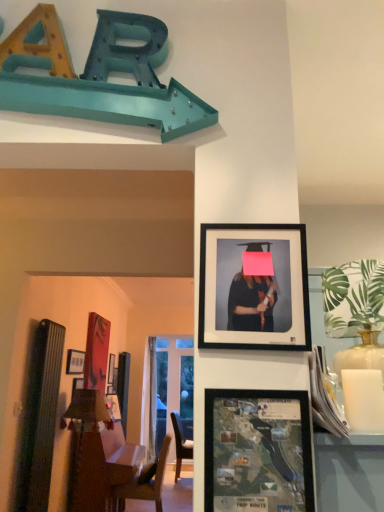
Question: Is wooden bulletin board at left positioned before matte black picture frame at upper left, acting as the third picture frame starting from the right?

Choices:
 (A) no
 (B) yes

Answer: (B)

Question: From a real-world perspective, is wooden bulletin board at left located higher than matte black picture frame at upper left, which appears as the first picture frame when viewed from the back?

Choices:
 (A) yes
 (B) no

Answer: (B)

Question: Does wooden bulletin board at left contain matte black picture frame at upper left, acting as the third picture frame starting from the right?

Choices:
 (A) no
 (B) yes

Answer: (A)

Question: Is wooden bulletin board at left not inside matte black picture frame at upper left, marked as the third picture frame in a top-to-bottom arrangement?

Choices:
 (A) no
 (B) yes

Answer: (B)

Question: Can you confirm if wooden bulletin board at left is smaller than matte black picture frame at upper left, marked as the 1th picture frame in a left-to-right arrangement?

Choices:
 (A) yes
 (B) no

Answer: (B)

Question: Is wooden bulletin board at left at the right side of matte black picture frame at upper left, the third picture frame viewed from the front?

Choices:
 (A) no
 (B) yes

Answer: (B)

Question: Does matte black frame at upper center, positioned as the 1th picture frame in right-to-left order, appear on the left side of wooden bulletin board at left?

Choices:
 (A) no
 (B) yes

Answer: (A)

Question: Is matte black frame at upper center, the 2th picture frame from the back, taller than wooden bulletin board at left?

Choices:
 (A) no
 (B) yes

Answer: (A)

Question: From the image's perspective, is matte black frame at upper center, which is the third picture frame from bottom to top, under wooden bulletin board at left?

Choices:
 (A) no
 (B) yes

Answer: (A)

Question: Is matte black frame at upper center, which is the third picture frame from bottom to top, oriented towards wooden bulletin board at left?

Choices:
 (A) no
 (B) yes

Answer: (A)

Question: Is matte black frame at upper center, positioned as the first picture frame in top-to-bottom order, not within wooden bulletin board at left?

Choices:
 (A) yes
 (B) no

Answer: (A)

Question: Considering the relative positions of matte black frame at upper center, the 2th picture frame from the back, and wooden bulletin board at left in the image provided, is matte black frame at upper center, the 2th picture frame from the back, to the right of wooden bulletin board at left from the viewer's perspective?

Choices:
 (A) yes
 (B) no

Answer: (A)

Question: Is matte black picture frame at upper left, the third picture frame viewed from the front, next to wooden bulletin board at left and touching it?

Choices:
 (A) no
 (B) yes

Answer: (A)